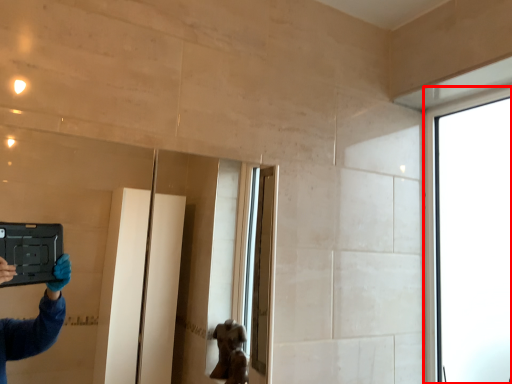
Question: From the image's perspective, where is window (annotated by the red box) located relative to mirror?

Choices:
 (A) above
 (B) below

Answer: (A)